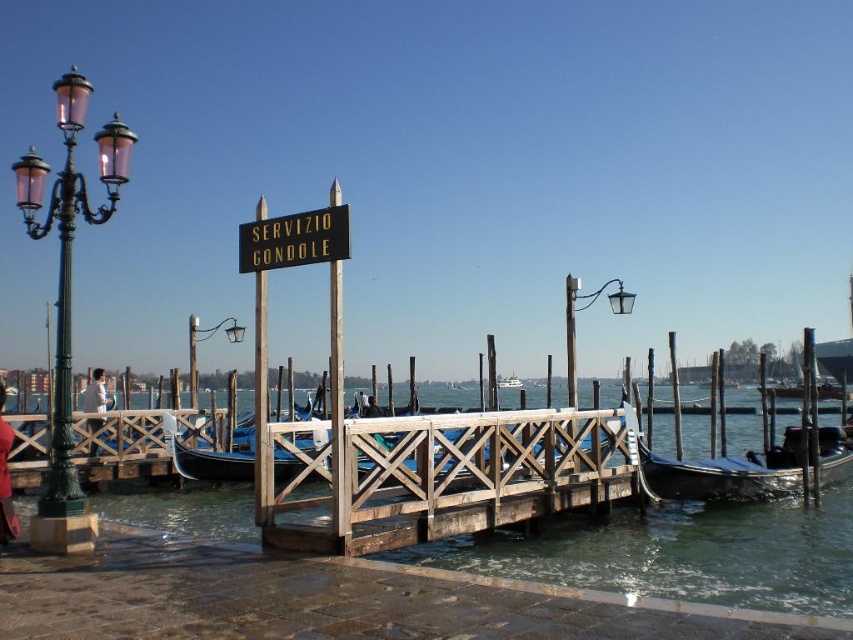
Between metallic sign at upper center and white glossy boat at center, which one has more height?

With more height is metallic sign at upper center.

Is metallic sign at upper center to the right of white glossy boat at center from the viewer's perspective?

No, metallic sign at upper center is not to the right of white glossy boat at center.

At what (x,y) coordinates should I click in order to perform the action: click on metallic sign at upper center. Please return your answer as a coordinate pair (x, y). This screenshot has width=853, height=640. Looking at the image, I should click on (x=337, y=404).

At what (x,y) coordinates should I click in order to perform the action: click on metallic sign at upper center. Please return your answer as a coordinate pair (x, y). This screenshot has height=640, width=853. Looking at the image, I should click on (337, 404).

Looking at this image, does shiny silver gondola at lower right have a greater width compared to metallic glass streetlamp at upper left?

Indeed, shiny silver gondola at lower right has a greater width compared to metallic glass streetlamp at upper left.

Is shiny silver gondola at lower right below metallic glass streetlamp at upper left?

Yes, shiny silver gondola at lower right is below metallic glass streetlamp at upper left.

The width and height of the screenshot is (853, 640). What are the coordinates of `shiny silver gondola at lower right` in the screenshot? It's located at (726, 472).

The image size is (853, 640). I want to click on shiny silver gondola at lower right, so click(x=726, y=472).

Does wooden dock at center have a lesser width compared to shiny silver gondola at lower right?

Correct, wooden dock at center's width is less than shiny silver gondola at lower right's.

Does wooden dock at center come in front of shiny silver gondola at lower right?

Yes, it is.

Locate an element on the screen. The width and height of the screenshot is (853, 640). wooden dock at center is located at coordinates (453, 474).